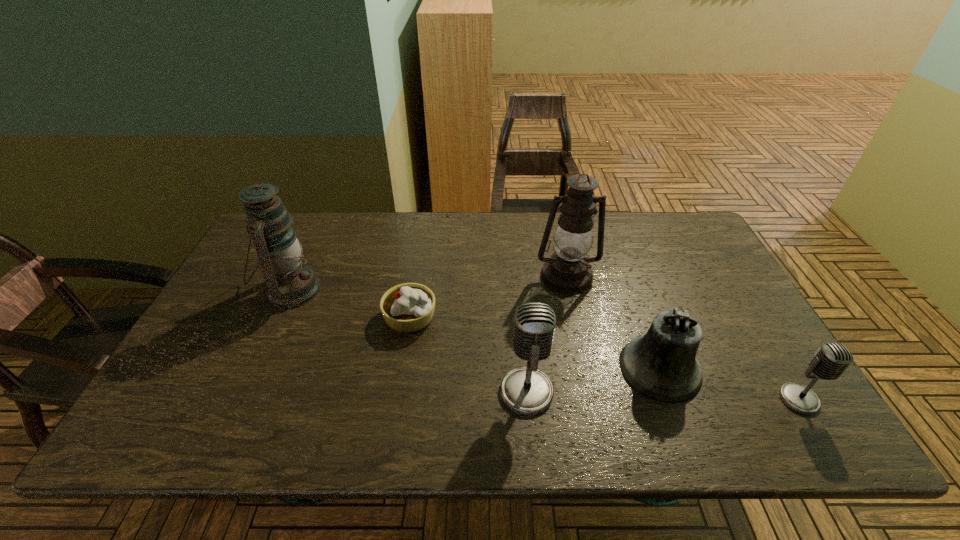
This screenshot has height=540, width=960. I want to click on vacant space located 0.050m on the left of the rightmost object, so click(758, 399).

In order to click on vacant area situated on the back of the left oil lamp in this screenshot , I will do `click(322, 226)`.

Find the location of a particular element. The image size is (960, 540). free location located 0.260m on the front of the right oil lamp is located at coordinates (588, 369).

Where is `free space located 0.300m on the back of the whipped cream`? Image resolution: width=960 pixels, height=540 pixels. free space located 0.300m on the back of the whipped cream is located at coordinates (423, 234).

Image resolution: width=960 pixels, height=540 pixels. I want to click on free region located on the right of the bell, so click(x=757, y=368).

I want to click on bell present at the near edge, so click(662, 365).

I want to click on object that is positioned at the left edge, so click(x=290, y=283).

Where is `object at the right edge`? This screenshot has height=540, width=960. object at the right edge is located at coordinates (831, 359).

I want to click on object at the near right corner, so click(x=831, y=359).

Where is `free region at the far edge of the desktop`? The width and height of the screenshot is (960, 540). free region at the far edge of the desktop is located at coordinates (640, 224).